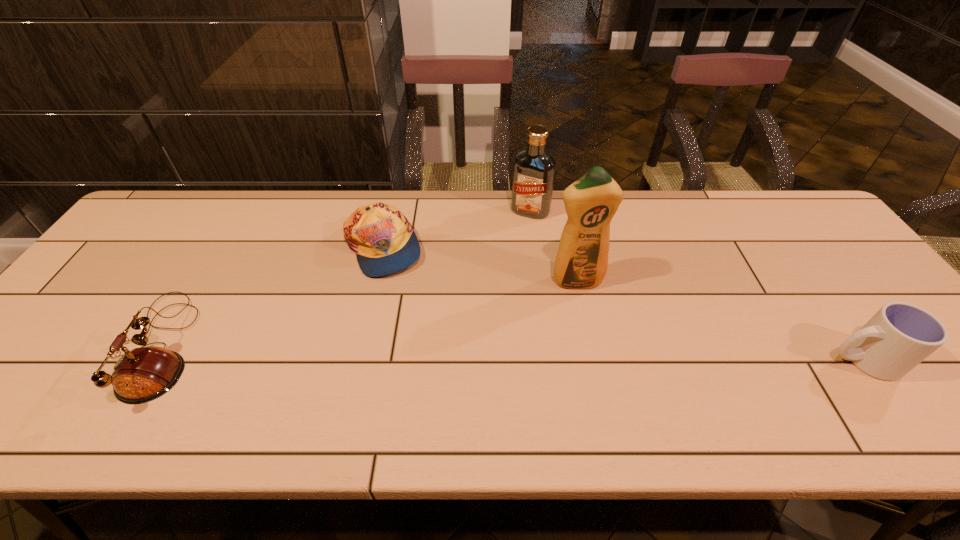
What are the coordinates of `vacant space in between the cap and the rightmost object` in the screenshot? It's located at (622, 303).

This screenshot has width=960, height=540. What are the coordinates of `vacant space that's between the second tallest object and the telephone` in the screenshot? It's located at (344, 279).

This screenshot has height=540, width=960. In order to click on free space between the fourth shortest object and the rightmost object in this screenshot , I will do `click(696, 285)`.

Find the location of a particular element. The height and width of the screenshot is (540, 960). free space between the fourth shortest object and the cup is located at coordinates tap(696, 285).

Locate an element on the screen. empty location between the cap and the second tallest object is located at coordinates (456, 230).

Locate an element on the screen. This screenshot has height=540, width=960. vacant area that lies between the second object from left to right and the detergent is located at coordinates (479, 265).

Find the location of a particular element. free area in between the tallest object and the second tallest object is located at coordinates (553, 246).

The height and width of the screenshot is (540, 960). I want to click on unoccupied position between the leftmost object and the vodka, so click(344, 279).

Find the location of a particular element. This screenshot has height=540, width=960. empty space that is in between the rightmost object and the leftmost object is located at coordinates (510, 353).

Where is `object that can be found as the closest to the leftmost object`? object that can be found as the closest to the leftmost object is located at coordinates (384, 241).